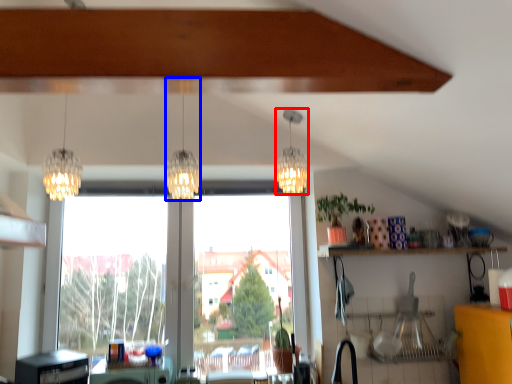
Question: Among these objects, which one is nearest to the camera, lamp (highlighted by a red box) or lamp (highlighted by a blue box)?

Choices:
 (A) lamp
 (B) lamp

Answer: (B)